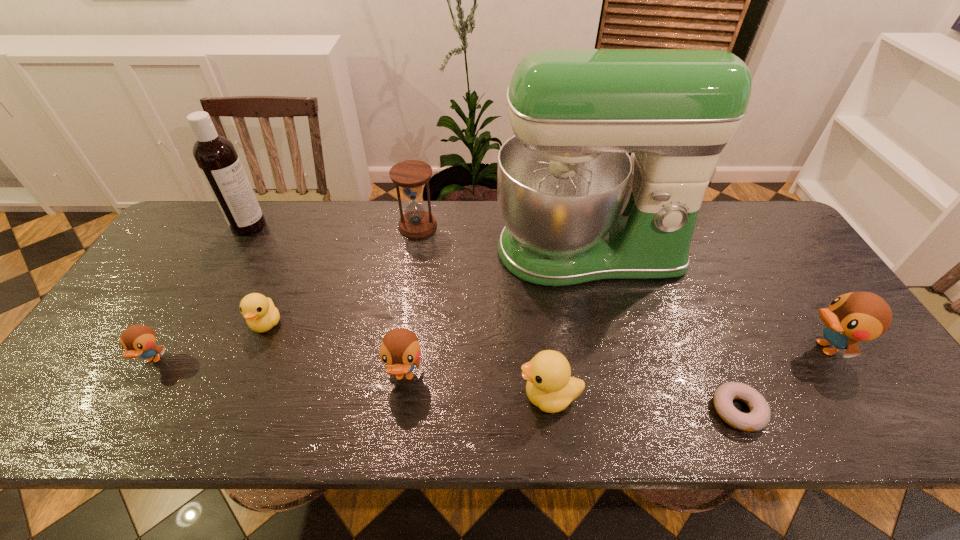
Point out which object is positioned as the second nearest to the smallest blue duck. Please provide its 2D coordinates. Your answer should be formatted as a tuple, i.e. [(x, y)], where the tuple contains the x and y coordinates of a point satisfying the conditions above.

[(216, 157)]

Locate which object ranks third in proximity to the hourglass. Please provide its 2D coordinates. Your answer should be formatted as a tuple, i.e. [(x, y)], where the tuple contains the x and y coordinates of a point satisfying the conditions above.

[(216, 157)]

Where is `duck that is the fifth closest to the dishwasher detergent`? duck that is the fifth closest to the dishwasher detergent is located at coordinates (857, 316).

Identify the location of duck that stands as the third closest to the smaller yellow duck. (549, 386).

Identify which blue duck is the second closest to the doughnut. Please provide its 2D coordinates. Your answer should be formatted as a tuple, i.e. [(x, y)], where the tuple contains the x and y coordinates of a point satisfying the conditions above.

[(400, 350)]

Image resolution: width=960 pixels, height=540 pixels. Find the location of `the second closest blue duck relative to the right yellow duck`. the second closest blue duck relative to the right yellow duck is located at coordinates (857, 316).

Locate an element on the screen. free space that satisfies the following two spatial constraints: 1. on the controls of the doughnut; 2. on the left side of the tallest object is located at coordinates (627, 410).

Find the location of `vacant space that satisfies the following two spatial constraints: 1. on the front-facing side of the brown doughnut; 2. on the right side of the leftmost blue duck`. vacant space that satisfies the following two spatial constraints: 1. on the front-facing side of the brown doughnut; 2. on the right side of the leftmost blue duck is located at coordinates (123, 410).

I want to click on free location that satisfies the following two spatial constraints: 1. on the controls of the tallest object; 2. on the face of the bigger yellow duck, so (x=624, y=396).

I want to click on free location that satisfies the following two spatial constraints: 1. on the front-facing side of the doughnut; 2. on the left side of the leftmost duck, so pyautogui.click(x=123, y=410).